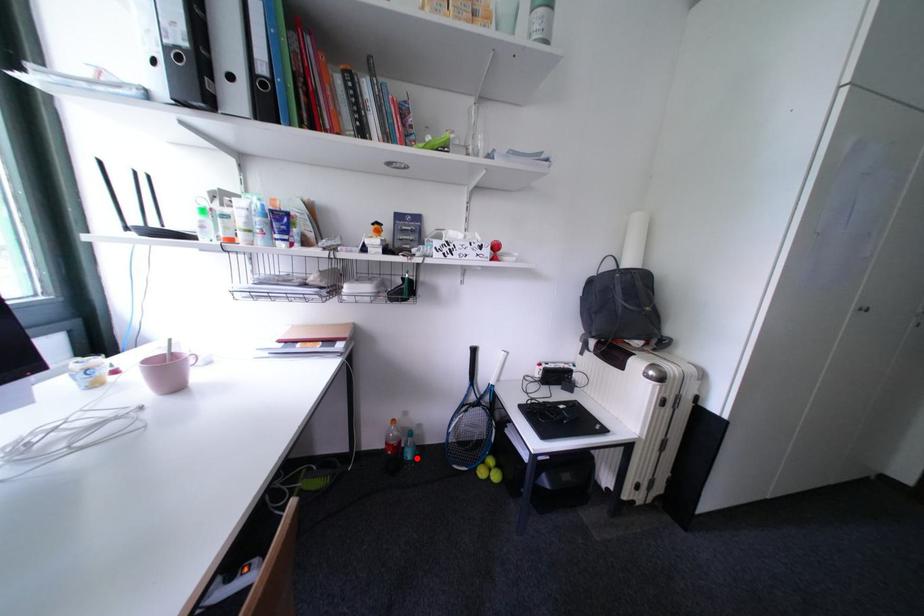
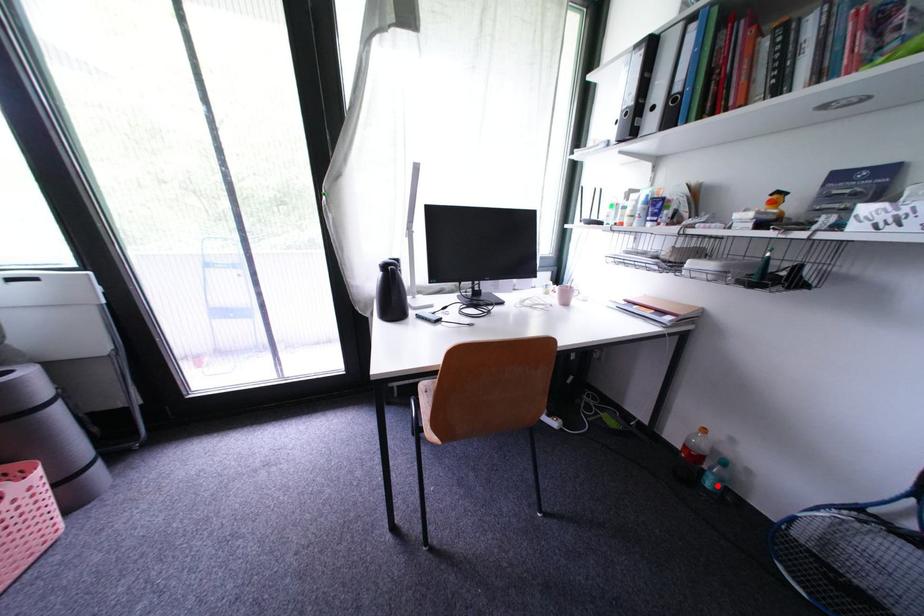
I am providing you with two images of the same scene from different viewpoints. A red point is marked on the first image and another point is marked on the second image. Do the highlighted points in image1 and image2 indicate the same real-world spot?

Yes